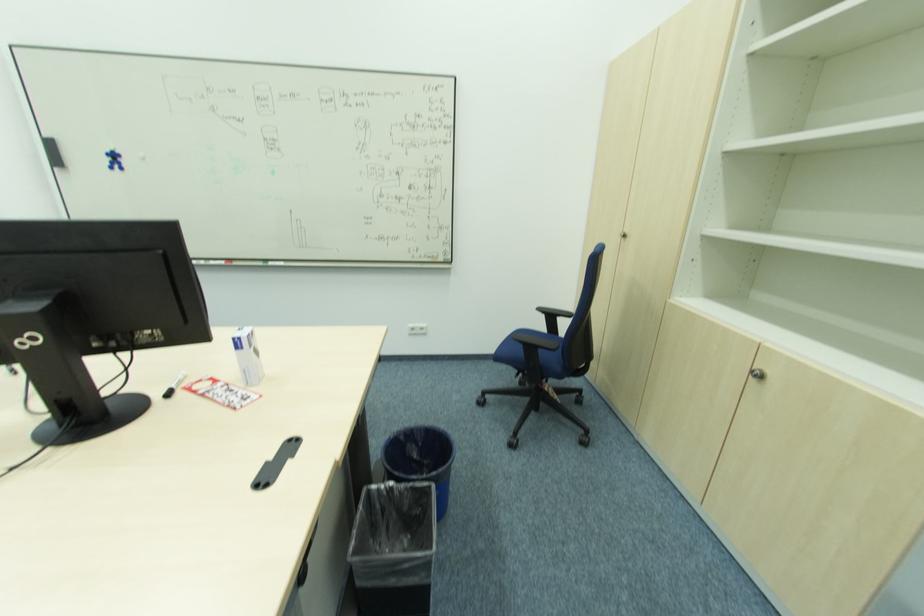
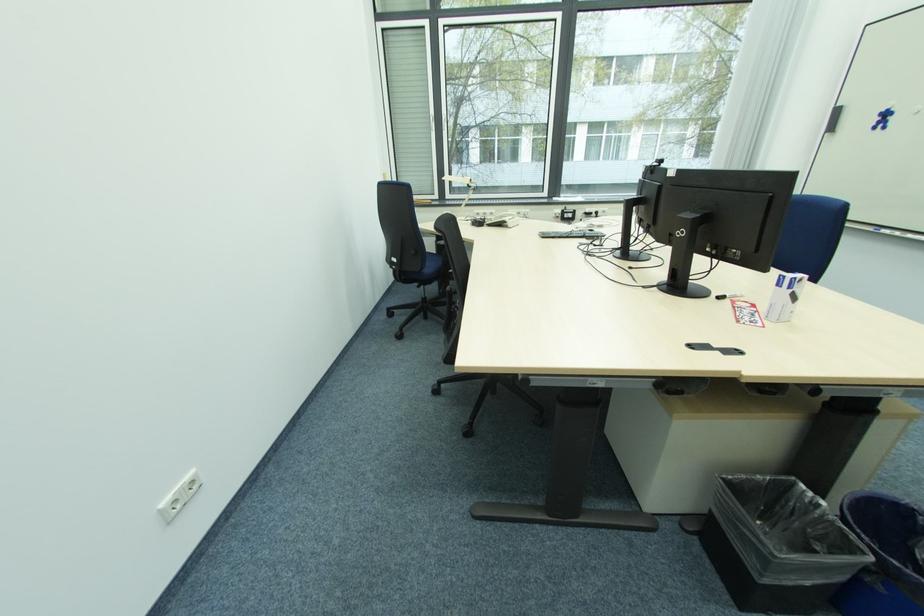
Find the pixel in the second image that matches [382,492] in the first image.

(808, 495)